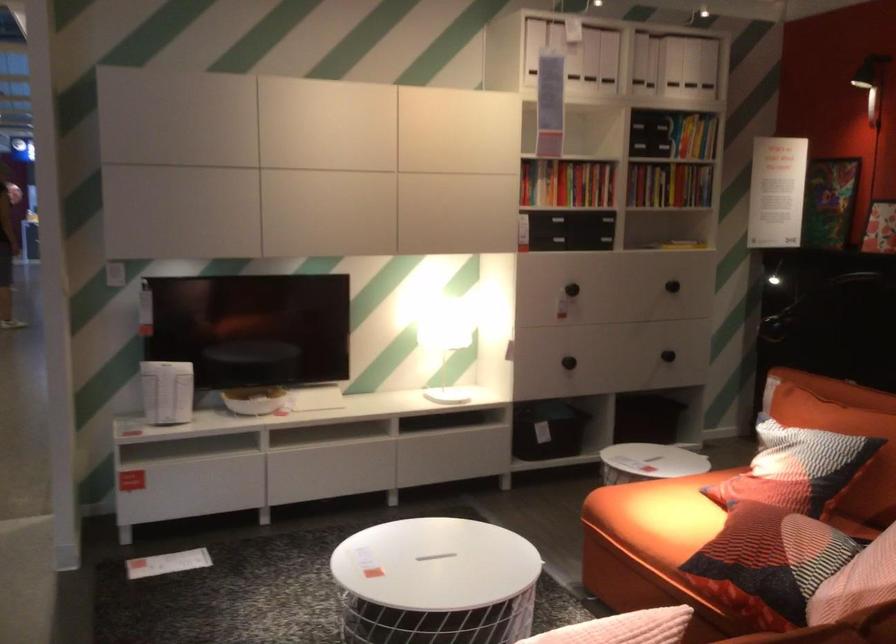
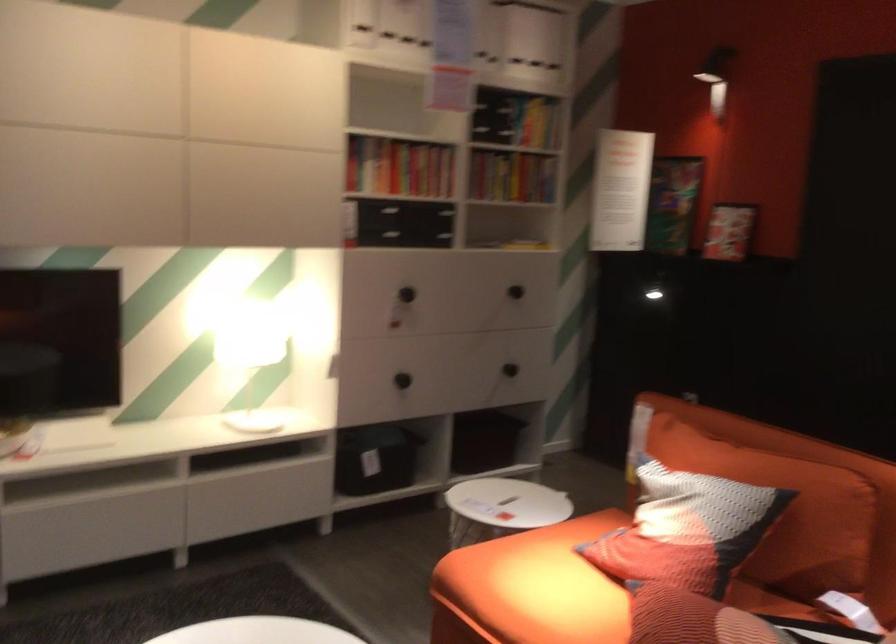
Find the pixel in the second image that matches (x=451, y=333) in the first image.

(250, 354)